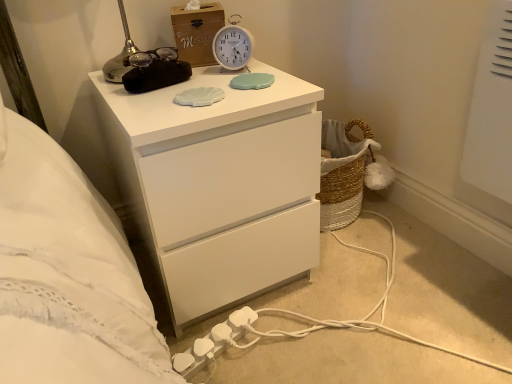
This screenshot has width=512, height=384. What are the coordinates of `white plastic extension cord at lower center` in the screenshot? It's located at (213, 343).

Where is `white matte chest of drawers at upper center`? The height and width of the screenshot is (384, 512). white matte chest of drawers at upper center is located at coordinates (219, 185).

Identify the location of white plastic extension cord at lower center. (213, 343).

From the image's perspective, between woodenmaterial/texturebox at upper center and white plastic alarm clock at upper center, which one is located above?

woodenmaterial/texturebox at upper center, from the image's perspective.

Could you measure the distance between woodenmaterial/texturebox at upper center and white plastic alarm clock at upper center?

The distance of woodenmaterial/texturebox at upper center from white plastic alarm clock at upper center is 2.38 inches.

Where is `alarm clock on the right of woodenmaterial/texturebox at upper center`? The height and width of the screenshot is (384, 512). alarm clock on the right of woodenmaterial/texturebox at upper center is located at coordinates (x=233, y=45).

Considering the positions of objects woodenmaterial/texturebox at upper center and white plastic alarm clock at upper center in the image provided, who is more to the left, woodenmaterial/texturebox at upper center or white plastic alarm clock at upper center?

woodenmaterial/texturebox at upper center.

Which is correct: white plastic extension cord at lower center is inside white plastic power strip at lower center, or outside of it?

white plastic extension cord at lower center is located inside white plastic power strip at lower center.

Does white plastic extension cord at lower center have a greater height compared to white plastic power strip at lower center?

No, white plastic extension cord at lower center is not taller than white plastic power strip at lower center.

Which object is closer to the camera, white plastic extension cord at lower center or white plastic power strip at lower center?

white plastic power strip at lower center is in front.

Who is bigger, white plastic extension cord at lower center or white plastic power strip at lower center?

Bigger between the two is white plastic power strip at lower center.

Is white plastic extension cord at lower center in front of white plastic alarm clock at upper center?

Yes, white plastic extension cord at lower center is closer to the viewer.

Is point (207, 360) more distant than point (220, 61)?

No, (207, 360) is in front of (220, 61).

How far apart are white plastic extension cord at lower center and white plastic alarm clock at upper center?

A distance of 25.55 inches exists between white plastic extension cord at lower center and white plastic alarm clock at upper center.

Visually, is white plastic extension cord at lower center positioned to the left or to the right of white plastic alarm clock at upper center?

In the image, white plastic extension cord at lower center appears on the left side of white plastic alarm clock at upper center.

Which is in front, point (211, 356) or point (104, 84)?

The point (211, 356) is closer to the camera.

Is white plastic extension cord at lower center in front of or behind white matte chest of drawers at upper center in the image?

In the image, white plastic extension cord at lower center appears behind white matte chest of drawers at upper center.

Is white plastic extension cord at lower center wider or thinner than white matte chest of drawers at upper center?

white plastic extension cord at lower center is thinner than white matte chest of drawers at upper center.

How far apart are white plastic extension cord at lower center and white matte chest of drawers at upper center?

white plastic extension cord at lower center is 12.59 inches away from white matte chest of drawers at upper center.

From a real-world perspective, is white plastic extension cord at lower center located beneath woodenmaterial/texturebox at upper center?

Yes.

Is point (216, 341) positioned in front of point (215, 24)?

Yes.

Can you see white plastic extension cord at lower center touching woodenmaterial/texturebox at upper center?

No, white plastic extension cord at lower center is not next to woodenmaterial/texturebox at upper center.

Relative to woodenmaterial/texturebox at upper center, is white plastic extension cord at lower center in front or behind?

In the image, white plastic extension cord at lower center appears in front of woodenmaterial/texturebox at upper center.

Is white matte chest of drawers at upper center wider or thinner than white plastic power strip at lower center?

Clearly, white matte chest of drawers at upper center has less width compared to white plastic power strip at lower center.

Which is more to the right, white matte chest of drawers at upper center or white plastic power strip at lower center?

Positioned to the right is white plastic power strip at lower center.

Based on the photo, which is correct: white matte chest of drawers at upper center is inside white plastic power strip at lower center, or outside of it?

white matte chest of drawers at upper center lies outside white plastic power strip at lower center.

This screenshot has width=512, height=384. In order to click on the chest of drawers above the white plastic power strip at lower center (from the image's perspective) in this screenshot , I will do `click(219, 185)`.

Between woodenmaterial/texturebox at upper center and white plastic power strip at lower center, which one has more height?

With more height is woodenmaterial/texturebox at upper center.

Based on the photo, is white plastic power strip at lower center at the back of woodenmaterial/texturebox at upper center?

No, woodenmaterial/texturebox at upper center is not facing away from white plastic power strip at lower center.

Does woodenmaterial/texturebox at upper center touch white plastic power strip at lower center?

woodenmaterial/texturebox at upper center and white plastic power strip at lower center are clearly separated.

Would you say woodenmaterial/texturebox at upper center is outside white plastic power strip at lower center?

Yes, woodenmaterial/texturebox at upper center is outside of white plastic power strip at lower center.

This screenshot has width=512, height=384. What are the coordinates of `alarm clock on the right of the woodenmaterial/texturebox at upper center` in the screenshot? It's located at (233, 45).

Identify the location of cable above the white plastic extension cord at lower center (from the image's perspective). The width and height of the screenshot is (512, 384). (x=447, y=293).

From the image, which object appears to be nearer to woodenmaterial/texturebox at upper center, white plastic alarm clock at upper center or white plastic power strip at lower center?

The object closer to woodenmaterial/texturebox at upper center is white plastic alarm clock at upper center.

Considering their positions, is woodenmaterial/texturebox at upper center positioned further to white plastic alarm clock at upper center than white plastic power strip at lower center?

white plastic power strip at lower center.

Considering their positions, is white plastic extension cord at lower center positioned further to white plastic power strip at lower center than white matte chest of drawers at upper center?

Based on the image, white matte chest of drawers at upper center appears to be further to white plastic power strip at lower center.

Looking at the image, which one is located further to white plastic alarm clock at upper center, white matte chest of drawers at upper center or woodenmaterial/texturebox at upper center?

white matte chest of drawers at upper center.

Considering their positions, is white plastic extension cord at lower center positioned further to woodenmaterial/texturebox at upper center than white plastic alarm clock at upper center?

Based on the image, white plastic extension cord at lower center appears to be further to woodenmaterial/texturebox at upper center.

When comparing their distances from woodenmaterial/texturebox at upper center, does white plastic alarm clock at upper center or white plastic extension cord at lower center seem closer?

white plastic alarm clock at upper center is positioned closer to the anchor woodenmaterial/texturebox at upper center.

Based on the photo, when comparing their distances from white plastic power strip at lower center, does woodenmaterial/texturebox at upper center or white matte chest of drawers at upper center seem further?

woodenmaterial/texturebox at upper center.

From the image, which object appears to be nearer to white plastic extension cord at lower center, white plastic alarm clock at upper center or white plastic power strip at lower center?

Among the two, white plastic power strip at lower center is located nearer to white plastic extension cord at lower center.

I want to click on chest of drawers between white plastic alarm clock at upper center and white plastic extension cord at lower center in the vertical direction, so click(219, 185).

Image resolution: width=512 pixels, height=384 pixels. What are the coordinates of `chest of drawers between woodenmaterial/texturebox at upper center and white plastic extension cord at lower center in the up-down direction` in the screenshot? It's located at (219, 185).

Identify the location of chest of drawers between woodenmaterial/texturebox at upper center and white plastic power strip at lower center from top to bottom. (219, 185).

This screenshot has height=384, width=512. Identify the location of alarm clock between woodenmaterial/texturebox at upper center and white plastic power strip at lower center from top to bottom. (233, 45).